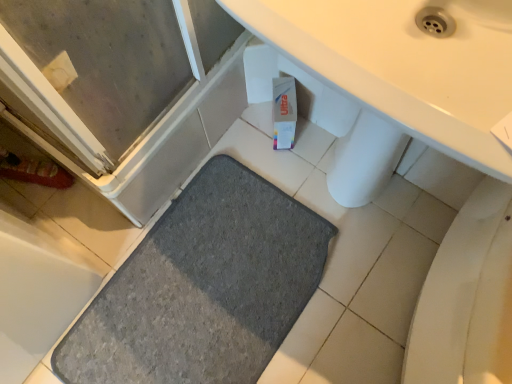
In order to click on vacant space to the right of gray carpet at lower left in this screenshot , I will do `click(349, 283)`.